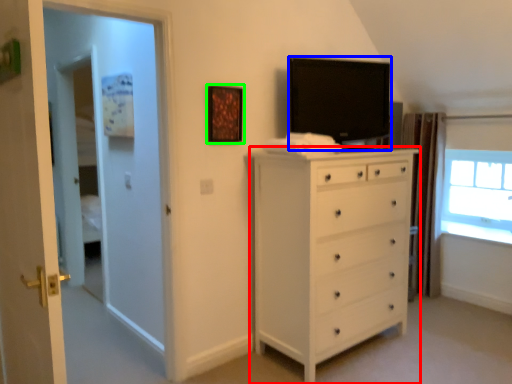
Question: Considering the real-world distances, which object is farthest from chest of drawers (highlighted by a red box)? television (highlighted by a blue box) or picture frame (highlighted by a green box)?

Choices:
 (A) television
 (B) picture frame

Answer: (B)